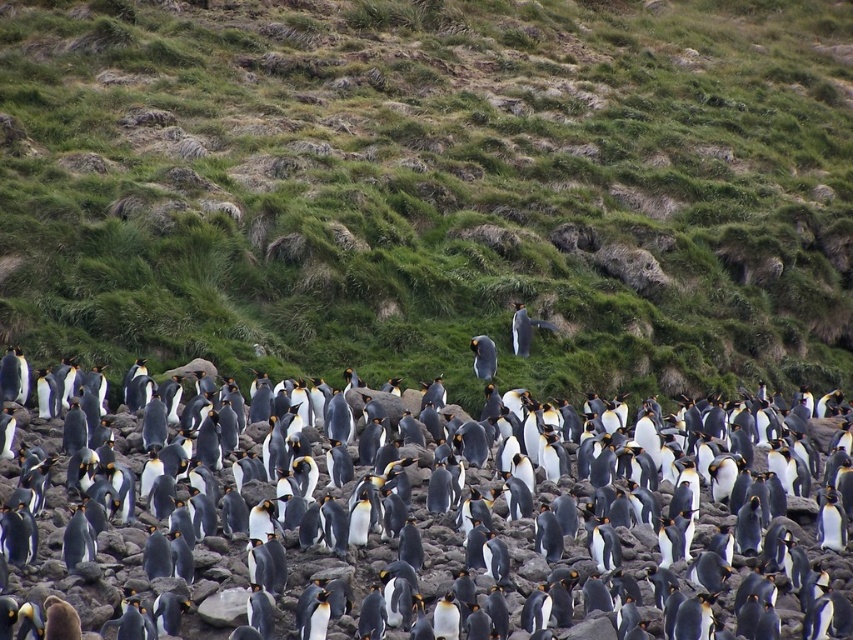
Question: Observing the image, what is the correct spatial positioning of green grassy hillside at upper center in reference to black glossy penguin at center?

Choices:
 (A) left
 (B) right

Answer: (B)

Question: Is green grassy hillside at upper center in front of white fluffy penguin at center?

Choices:
 (A) no
 (B) yes

Answer: (B)

Question: Which of these objects is positioned closest to the green grassy hillside at upper center?

Choices:
 (A) black matte penguin at center
 (B) black glossy penguin at center
 (C) white fluffy penguin at center

Answer: (B)

Question: Is the position of black matte penguin at center less distant than that of black glossy penguin at center?

Choices:
 (A) no
 (B) yes

Answer: (B)

Question: Which point is closer to the camera?

Choices:
 (A) (587, 451)
 (B) (103, 312)
 (C) (515, 339)
 (D) (486, 356)

Answer: (A)

Question: Which object is farther from the camera taking this photo?

Choices:
 (A) white fluffy penguin at center
 (B) black matte penguin at center

Answer: (A)